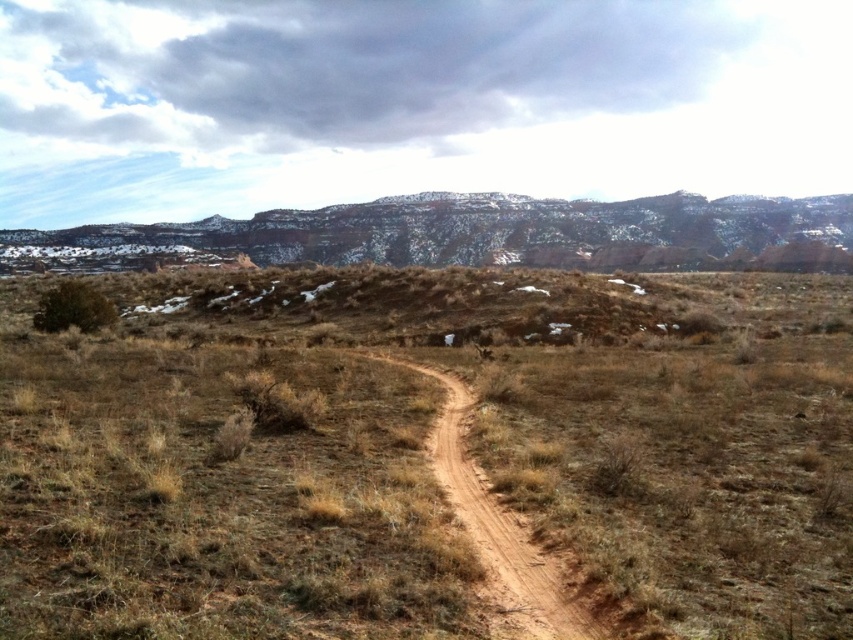
You are standing on the brown dirt track at center and want to reach the rustic stone mountain at upper center. Which direction should you walk to get closer to the mountain?

You should walk to the right along the brown dirt track at center since the rustic stone mountain at upper center is located to the right of it.

You are a hiker standing at the starting point of the brown dirt path at center and the brown dirt track at center. You want to reach the nearest hill covered in snow. Which path should you take to get there faster?

The brown dirt path at center is 22.87 meters from brown dirt track at center. So, you should take the brown dirt track at center because it is closer to the nearest hill covered in snow.